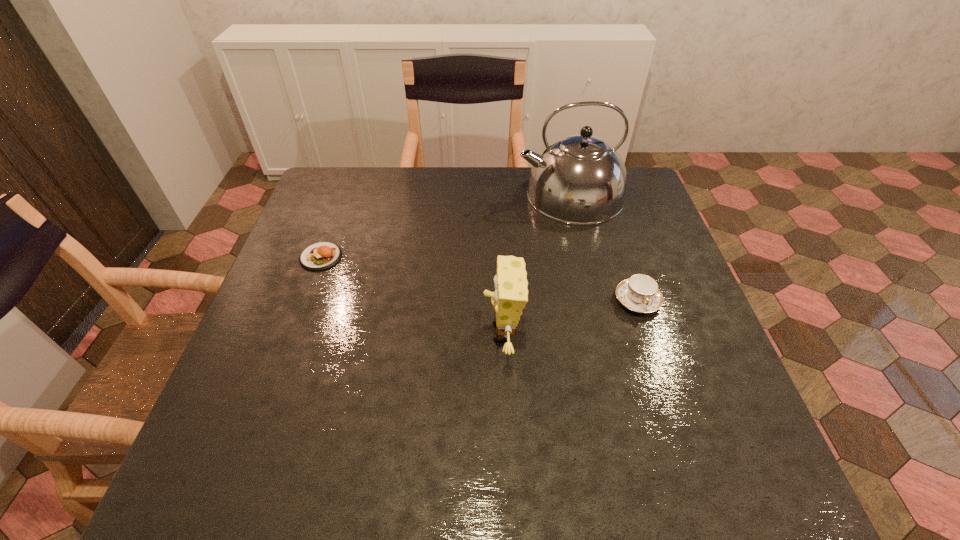
You are a GUI agent. You are given a task and a screenshot of the screen. Output one action in this format:
    pyautogui.click(x=<x>, y=<y>)
    Task: Click on the farthest object
    The height and width of the screenshot is (540, 960).
    Given the screenshot: What is the action you would take?
    pyautogui.click(x=580, y=179)

What are the coordinates of `the tallest object` in the screenshot? It's located at (580, 179).

Find the location of `the third shortest object`. the third shortest object is located at coordinates (511, 295).

Locate an element on the screen. The image size is (960, 540). sponge is located at coordinates (511, 295).

You are a GUI agent. You are given a task and a screenshot of the screen. Output one action in this format:
    pyautogui.click(x=<x>, y=<y>)
    Task: Click on the teacup
    
    Given the screenshot: What is the action you would take?
    pyautogui.click(x=640, y=293)

You are a GUI agent. You are given a task and a screenshot of the screen. Output one action in this format:
    pyautogui.click(x=<x>, y=<y>)
    Task: Click on the patty (food)
    
    Given the screenshot: What is the action you would take?
    pyautogui.click(x=319, y=256)

Locate an element on the screen. Image resolution: width=960 pixels, height=540 pixels. the second farthest object is located at coordinates (319, 256).

Find the location of a particular element. This screenshot has width=960, height=540. vacant space situated 0.050m from the spout of the kettle is located at coordinates (501, 195).

Find the location of a particular element. The image size is (960, 540). free spot located from the spout of the kettle is located at coordinates (468, 195).

Identify the location of vacant region located from the spout of the kettle. The height and width of the screenshot is (540, 960). (406, 195).